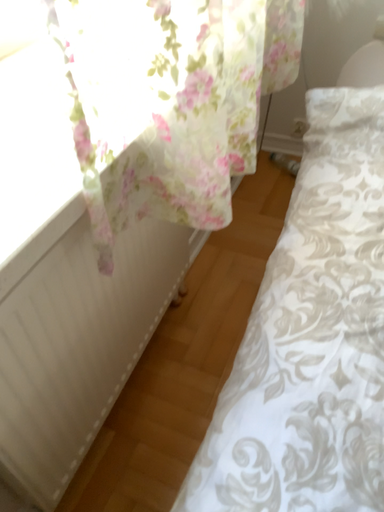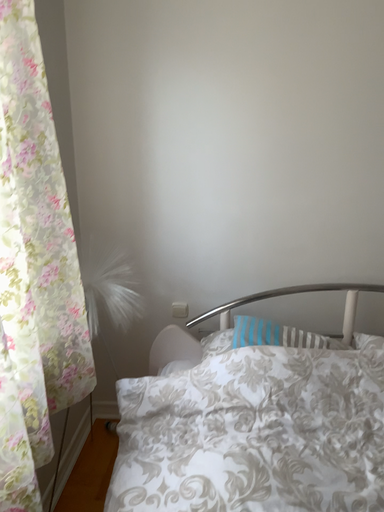
Question: How did the camera likely rotate when shooting the video?

Choices:
 (A) rotated upward
 (B) rotated downward

Answer: (A)